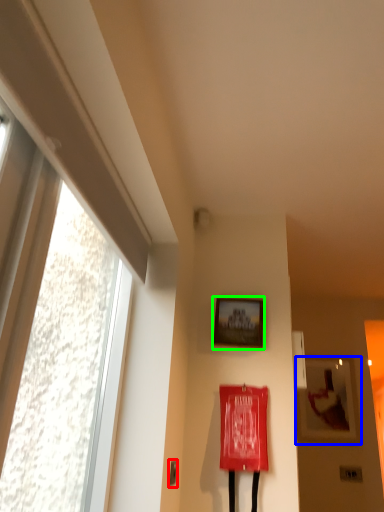
Question: Which object is the closest to the door handle (highlighted by a red box)? Choose among these: picture frame (highlighted by a blue box) or picture frame (highlighted by a green box).

Choices:
 (A) picture frame
 (B) picture frame

Answer: (B)